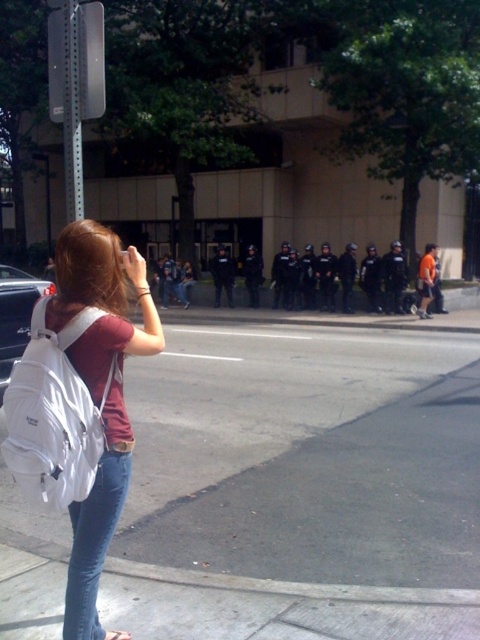
Question: Among these points, which one is farthest from the camera?

Choices:
 (A) (367, 525)
 (B) (73, 611)
 (C) (74, 168)
 (D) (96, 474)

Answer: (C)

Question: Does white fabric backpack at left appear under jeans at lower left?

Choices:
 (A) no
 (B) yes

Answer: (A)

Question: Which point is closer to the camera taking this photo?

Choices:
 (A) (87, 564)
 (B) (60, 51)
 (C) (204, 540)

Answer: (A)

Question: Is gray asphalt pavement at lower center smaller than jeans at lower left?

Choices:
 (A) no
 (B) yes

Answer: (A)

Question: Considering the real-world distances, which object is farthest from the jeans at lower left?

Choices:
 (A) gray asphalt pavement at lower center
 (B) white fabric backpack at left
 (C) metallic pole at upper left

Answer: (C)

Question: In this image, where is gray asphalt pavement at lower center located relative to jeans at lower left?

Choices:
 (A) below
 (B) above

Answer: (B)